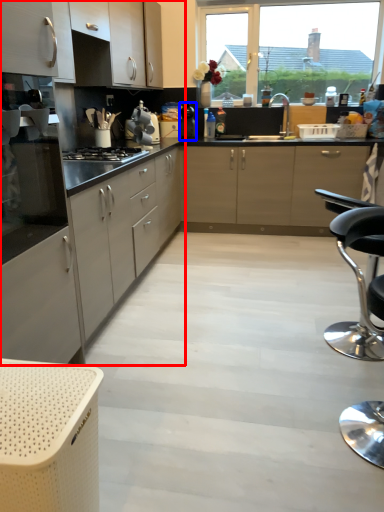
Question: Which point is further to the camera, cabinetry (highlighted by a red box) or kitchen appliance (highlighted by a blue box)?

Choices:
 (A) cabinetry
 (B) kitchen appliance

Answer: (B)